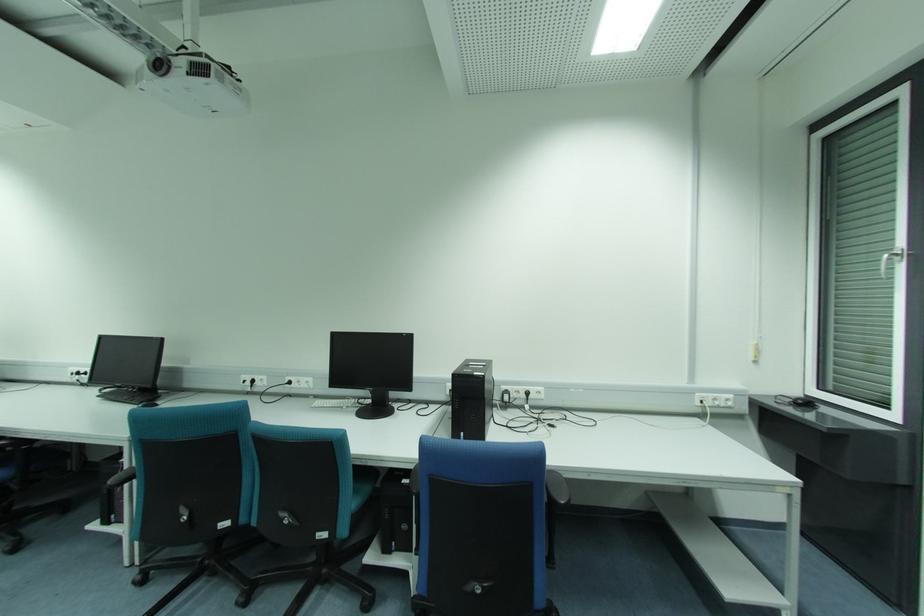
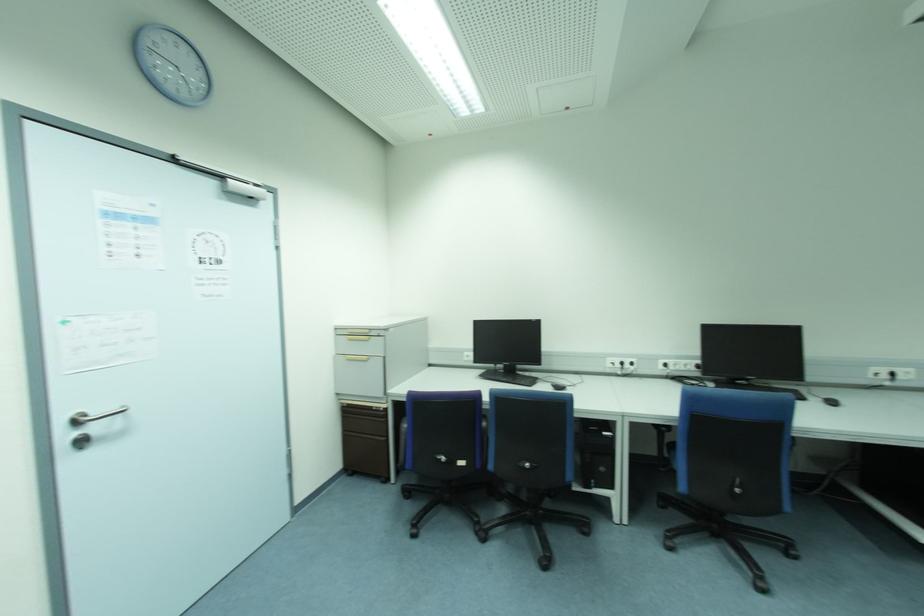
Question: The images are taken continuously from a first-person perspective. In which direction are you moving?

Choices:
 (A) Left
 (B) Right
 (C) Forward
 (D) Backward

Answer: (A)